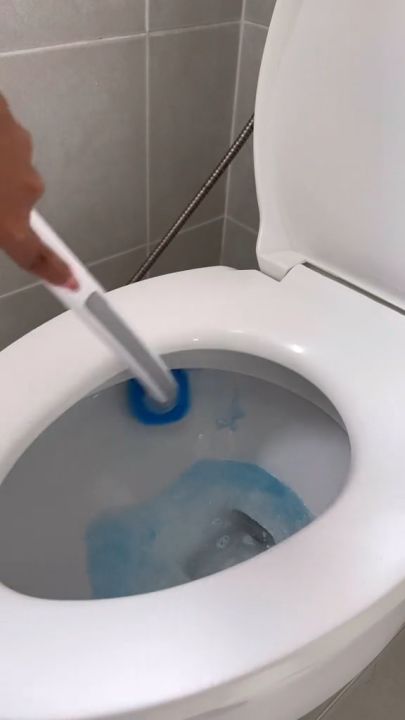
The height and width of the screenshot is (720, 405). What are the coordinates of `wall` in the screenshot? It's located at (173, 206).